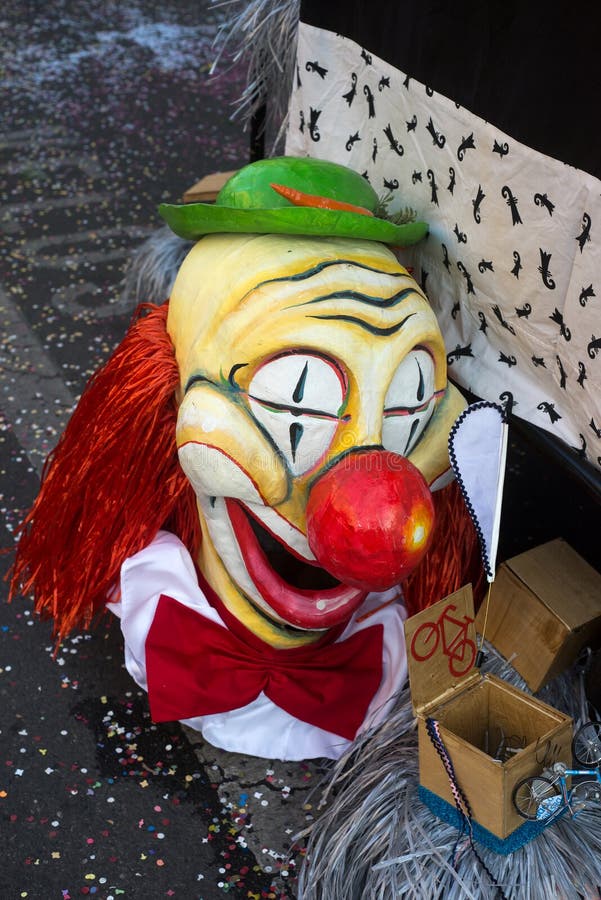
Where is `cloth towel`? Image resolution: width=601 pixels, height=900 pixels. cloth towel is located at coordinates (505, 248).